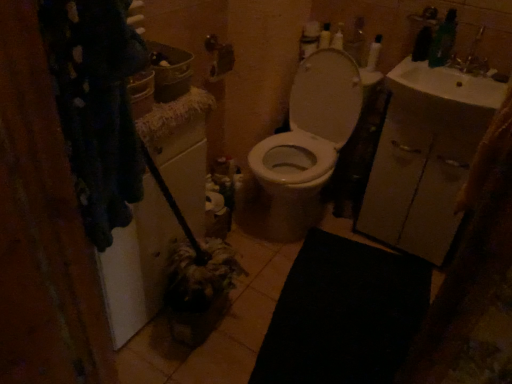
Question: Is white glossy toilet at center not close to white glossy sink at upper right?

Choices:
 (A) no
 (B) yes

Answer: (A)

Question: Could you tell me if white glossy toilet at center is turned towards white glossy sink at upper right?

Choices:
 (A) yes
 (B) no

Answer: (B)

Question: From the image's perspective, does white glossy toilet at center appear lower than white glossy sink at upper right?

Choices:
 (A) no
 (B) yes

Answer: (B)

Question: Considering the relative sizes of white glossy toilet at center and white glossy sink at upper right in the image provided, is white glossy toilet at center smaller than white glossy sink at upper right?

Choices:
 (A) yes
 (B) no

Answer: (B)

Question: Is white glossy toilet at center positioned beyond the bounds of white glossy sink at upper right?

Choices:
 (A) no
 (B) yes

Answer: (B)

Question: Does white glossy toilet at center appear on the left side of white glossy sink at upper right?

Choices:
 (A) yes
 (B) no

Answer: (A)

Question: Would you consider white glossy bottle at upper right to be distant from white glossy sink at upper right?

Choices:
 (A) yes
 (B) no

Answer: (B)

Question: Is white glossy bottle at upper right at the right side of white glossy sink at upper right?

Choices:
 (A) yes
 (B) no

Answer: (B)

Question: From the image's perspective, is white glossy bottle at upper right on white glossy sink at upper right?

Choices:
 (A) no
 (B) yes

Answer: (B)

Question: Is white glossy bottle at upper right in contact with white glossy sink at upper right?

Choices:
 (A) no
 (B) yes

Answer: (A)

Question: Is white glossy bottle at upper right thinner than white glossy sink at upper right?

Choices:
 (A) no
 (B) yes

Answer: (B)

Question: From a real-world perspective, is white glossy bottle at upper right located beneath white glossy sink at upper right?

Choices:
 (A) no
 (B) yes

Answer: (A)

Question: From a real-world perspective, is white glossy sink at upper right on top of white glossy bottle at upper right?

Choices:
 (A) yes
 (B) no

Answer: (B)